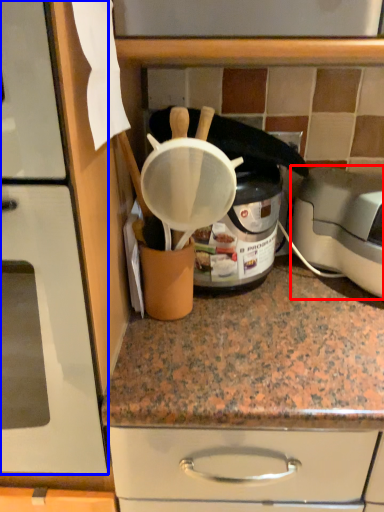
Question: Among these objects, which one is farthest to the camera, toaster (highlighted by a red box) or home appliance (highlighted by a blue box)?

Choices:
 (A) toaster
 (B) home appliance

Answer: (A)